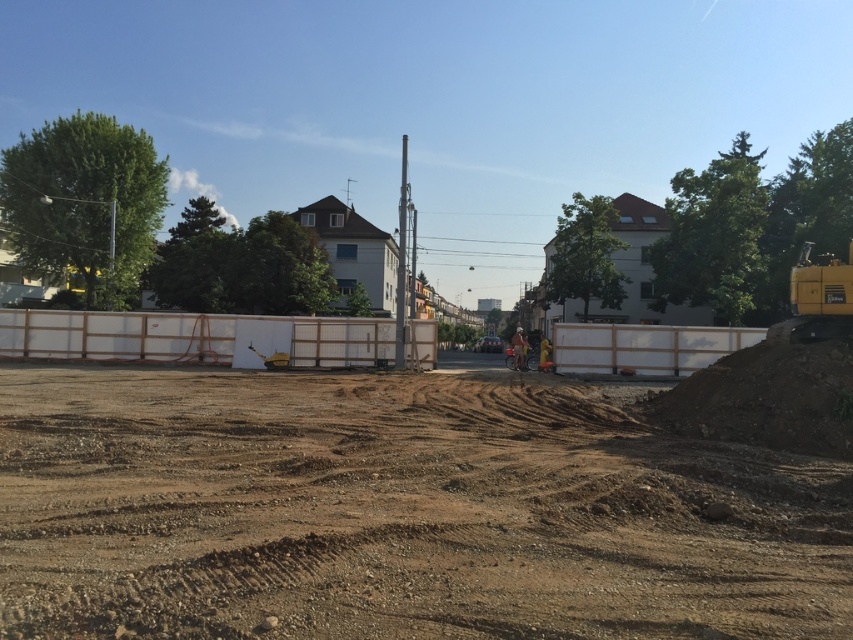
Question: Can you confirm if brown sandy dirt at center is positioned above white plastic barrier at center?

Choices:
 (A) yes
 (B) no

Answer: (B)

Question: Which of the following is the closest to the observer?

Choices:
 (A) white plastic barrier at center
 (B) yellow metallic excavator at right
 (C) brown sandy dirt at center

Answer: (C)

Question: Among these objects, which one is nearest to the camera?

Choices:
 (A) yellow metallic excavator at right
 (B) white wooden fence at center

Answer: (A)

Question: Which of the following is the closest to the observer?

Choices:
 (A) (827, 298)
 (B) (335, 356)

Answer: (A)

Question: Does white wooden fence at center appear under white plastic barrier at center?

Choices:
 (A) yes
 (B) no

Answer: (B)

Question: Where is brown sandy dirt at center located in relation to yellow metallic excavator at right in the image?

Choices:
 (A) above
 (B) below

Answer: (B)